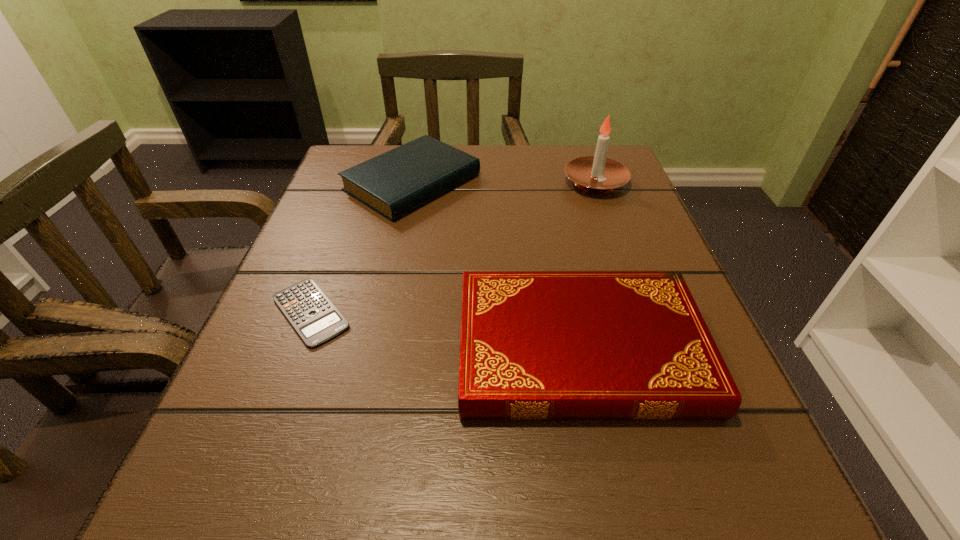
Find the location of a particular element. unoccupied area between the nearer book and the tallest object is located at coordinates (588, 266).

Find the location of a particular element. free space between the farther book and the calculator is located at coordinates (361, 247).

I want to click on the third closest object to the nearer book, so click(596, 174).

Identify which object is located as the second nearest to the shortest object. Please provide its 2D coordinates. Your answer should be formatted as a tuple, i.e. [(x, y)], where the tuple contains the x and y coordinates of a point satisfying the conditions above.

[(534, 345)]

At what (x,y) coordinates should I click in order to perform the action: click on free space that satisfies the following two spatial constraints: 1. on the front side of the candle; 2. on the cover of the nearer book. Please return your answer as a coordinate pair (x, y). The width and height of the screenshot is (960, 540). Looking at the image, I should click on (656, 349).

Locate an element on the screen. The height and width of the screenshot is (540, 960). vacant space that satisfies the following two spatial constraints: 1. on the back side of the shortest object; 2. on the right side of the farther book is located at coordinates (360, 183).